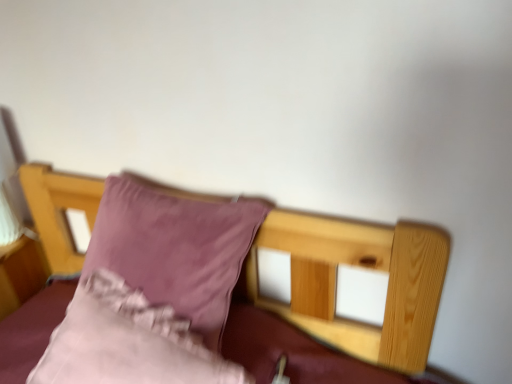
In the scene shown: Measure the distance between point [100,289] and camera.

Point [100,289] is 38.31 inches from camera.

Identify the location of pink satin pillow at center, acting as the 2th pillow starting from the top. (127, 342).

What is the approximate width of pink satin pillow at center, which is the 1th pillow from bottom to top?

pink satin pillow at center, which is the 1th pillow from bottom to top, is 11.25 inches in width.

The image size is (512, 384). What do you see at coordinates (127, 342) in the screenshot?
I see `pink satin pillow at center, acting as the 2th pillow starting from the top` at bounding box center [127, 342].

Describe the element at coordinates (175, 249) in the screenshot. I see `velvet pink pillow at center, positioned as the 1th pillow in top-to-bottom order` at that location.

What is the approximate height of velvet pink pillow at center, positioned as the 1th pillow in top-to-bottom order?

It is 16.92 inches.

Find the location of a particular element. Image resolution: width=512 pixels, height=384 pixels. velvet pink pillow at center, which is the 2th pillow from bottom to top is located at coordinates (175, 249).

Identify the location of pink satin pillow at center, which is the 1th pillow from bottom to top. (127, 342).

Would you say pink satin pillow at center, which is the 1th pillow from bottom to top, is to the left or to the right of velvet pink pillow at center, positioned as the 1th pillow in top-to-bottom order, in the picture?

Clearly, pink satin pillow at center, which is the 1th pillow from bottom to top, is on the left of velvet pink pillow at center, positioned as the 1th pillow in top-to-bottom order, in the image.

Does pink satin pillow at center, which is the 1th pillow from bottom to top, come in front of velvet pink pillow at center, which is the 2th pillow from bottom to top?

That is True.

Is point (108, 328) behind point (196, 325)?

No, (108, 328) is in front of (196, 325).

From the image's perspective, is pink satin pillow at center, acting as the 2th pillow starting from the top, above or below velvet pink pillow at center, positioned as the 1th pillow in top-to-bottom order?

pink satin pillow at center, acting as the 2th pillow starting from the top, is below velvet pink pillow at center, positioned as the 1th pillow in top-to-bottom order.

From a real-world perspective, is pink satin pillow at center, acting as the 2th pillow starting from the top, physically located above or below velvet pink pillow at center, which is the 2th pillow from bottom to top?

pink satin pillow at center, acting as the 2th pillow starting from the top, is below velvet pink pillow at center, which is the 2th pillow from bottom to top.

Is pink satin pillow at center, which is the 1th pillow from bottom to top, wider than velvet pink pillow at center, which is the 2th pillow from bottom to top?

No, pink satin pillow at center, which is the 1th pillow from bottom to top, is not wider than velvet pink pillow at center, which is the 2th pillow from bottom to top.

Based on the photo, who is taller, pink satin pillow at center, which is the 1th pillow from bottom to top, or velvet pink pillow at center, which is the 2th pillow from bottom to top?

velvet pink pillow at center, which is the 2th pillow from bottom to top.

Can you confirm if pink satin pillow at center, which is the 1th pillow from bottom to top, is bigger than velvet pink pillow at center, which is the 2th pillow from bottom to top?

Incorrect, pink satin pillow at center, which is the 1th pillow from bottom to top, is not larger than velvet pink pillow at center, which is the 2th pillow from bottom to top.

Is velvet pink pillow at center, positioned as the 1th pillow in top-to-bottom order, surrounded by pink satin pillow at center, acting as the 2th pillow starting from the top?

No, velvet pink pillow at center, positioned as the 1th pillow in top-to-bottom order, is not inside pink satin pillow at center, acting as the 2th pillow starting from the top.

Are pink satin pillow at center, acting as the 2th pillow starting from the top, and velvet pink pillow at center, which is the 2th pillow from bottom to top, making contact?

pink satin pillow at center, acting as the 2th pillow starting from the top, and velvet pink pillow at center, which is the 2th pillow from bottom to top, are not in contact.

Is velvet pink pillow at center, positioned as the 1th pillow in top-to-bottom order, at the back of pink satin pillow at center, acting as the 2th pillow starting from the top?

Yes, velvet pink pillow at center, positioned as the 1th pillow in top-to-bottom order, is at the back of pink satin pillow at center, acting as the 2th pillow starting from the top.

Can you tell me how much pink satin pillow at center, which is the 1th pillow from bottom to top, and velvet pink pillow at center, positioned as the 1th pillow in top-to-bottom order, differ in facing direction?

0.000706 degrees separate the facing orientations of pink satin pillow at center, which is the 1th pillow from bottom to top, and velvet pink pillow at center, positioned as the 1th pillow in top-to-bottom order.

Looking at this image, how far apart are pink satin pillow at center, which is the 1th pillow from bottom to top, and velvet pink pillow at center, which is the 2th pillow from bottom to top?

5.05 inches.

Locate an element on the screen. Image resolution: width=512 pixels, height=384 pixels. pillow above the pink satin pillow at center, acting as the 2th pillow starting from the top (from a real-world perspective) is located at coordinates (175, 249).

Can you confirm if velvet pink pillow at center, which is the 2th pillow from bottom to top, is positioned to the right of pink satin pillow at center, acting as the 2th pillow starting from the top?

Yes.

Considering their positions, is velvet pink pillow at center, positioned as the 1th pillow in top-to-bottom order, located in front of or behind pink satin pillow at center, which is the 1th pillow from bottom to top?

In the image, velvet pink pillow at center, positioned as the 1th pillow in top-to-bottom order, appears behind pink satin pillow at center, which is the 1th pillow from bottom to top.

Between point (216, 250) and point (148, 334), which one is positioned in front?

The point (148, 334) is closer to the camera.

From the image's perspective, is velvet pink pillow at center, which is the 2th pillow from bottom to top, under pink satin pillow at center, which is the 1th pillow from bottom to top?

Actually, velvet pink pillow at center, which is the 2th pillow from bottom to top, appears above pink satin pillow at center, which is the 1th pillow from bottom to top, in the image.

From a real-world perspective, who is located lower, velvet pink pillow at center, positioned as the 1th pillow in top-to-bottom order, or pink satin pillow at center, acting as the 2th pillow starting from the top?

pink satin pillow at center, acting as the 2th pillow starting from the top, from a real-world perspective.

Considering the relative sizes of velvet pink pillow at center, positioned as the 1th pillow in top-to-bottom order, and pink satin pillow at center, acting as the 2th pillow starting from the top, in the image provided, is velvet pink pillow at center, positioned as the 1th pillow in top-to-bottom order, thinner than pink satin pillow at center, acting as the 2th pillow starting from the top,?

No, velvet pink pillow at center, positioned as the 1th pillow in top-to-bottom order, is not thinner than pink satin pillow at center, acting as the 2th pillow starting from the top.

Can you confirm if velvet pink pillow at center, positioned as the 1th pillow in top-to-bottom order, is taller than pink satin pillow at center, acting as the 2th pillow starting from the top?

Yes, velvet pink pillow at center, positioned as the 1th pillow in top-to-bottom order, is taller than pink satin pillow at center, acting as the 2th pillow starting from the top.

Considering the sizes of velvet pink pillow at center, positioned as the 1th pillow in top-to-bottom order, and pink satin pillow at center, which is the 1th pillow from bottom to top, in the image, is velvet pink pillow at center, positioned as the 1th pillow in top-to-bottom order, bigger or smaller than pink satin pillow at center, which is the 1th pillow from bottom to top,?

Considering their sizes, velvet pink pillow at center, positioned as the 1th pillow in top-to-bottom order, takes up more space than pink satin pillow at center, which is the 1th pillow from bottom to top.

Is velvet pink pillow at center, which is the 2th pillow from bottom to top, situated inside pink satin pillow at center, which is the 1th pillow from bottom to top, or outside?

velvet pink pillow at center, which is the 2th pillow from bottom to top, is not enclosed by pink satin pillow at center, which is the 1th pillow from bottom to top.

From the picture: Is velvet pink pillow at center, which is the 2th pillow from bottom to top, aimed at pink satin pillow at center, which is the 1th pillow from bottom to top?

Yes, velvet pink pillow at center, which is the 2th pillow from bottom to top, is oriented towards pink satin pillow at center, which is the 1th pillow from bottom to top.

How many degrees apart are the facing directions of velvet pink pillow at center, positioned as the 1th pillow in top-to-bottom order, and pink satin pillow at center, which is the 1th pillow from bottom to top?

The angle between the facing direction of velvet pink pillow at center, positioned as the 1th pillow in top-to-bottom order, and the facing direction of pink satin pillow at center, which is the 1th pillow from bottom to top, is 0.000706 degrees.

How far apart are velvet pink pillow at center, which is the 2th pillow from bottom to top, and pink satin pillow at center, acting as the 2th pillow starting from the top?

velvet pink pillow at center, which is the 2th pillow from bottom to top, and pink satin pillow at center, acting as the 2th pillow starting from the top, are 5.05 inches apart.

What are the coordinates of `pillow on the right of the pink satin pillow at center, which is the 1th pillow from bottom to top` in the screenshot? It's located at (175, 249).

I want to click on pillow that is above the pink satin pillow at center, acting as the 2th pillow starting from the top (from the image's perspective), so click(175, 249).

In order to click on pillow below the velvet pink pillow at center, positioned as the 1th pillow in top-to-bottom order (from a real-world perspective) in this screenshot , I will do `click(127, 342)`.